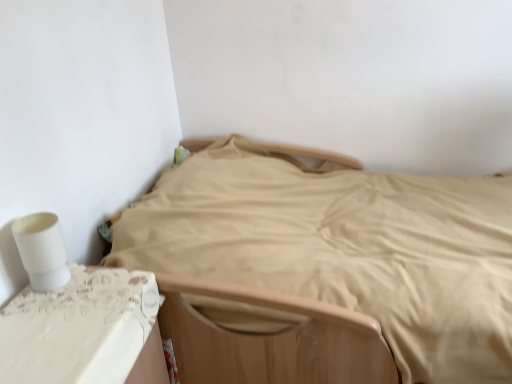
This screenshot has width=512, height=384. I want to click on vacant area that is in front of white matte toilet paper at left, so click(42, 319).